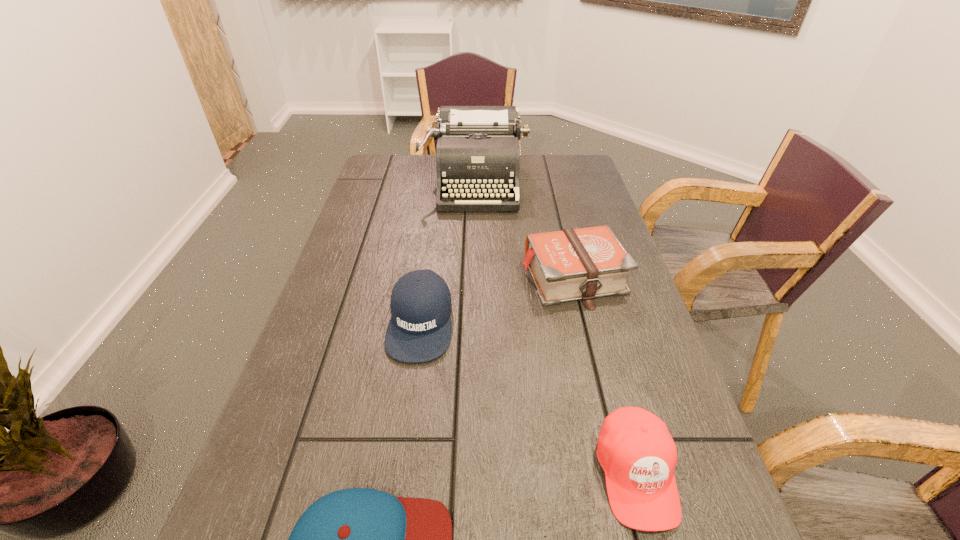
At what (x,y) coordinates should I click in order to perform the action: click on Bible at the right edge. Please return your answer as a coordinate pair (x, y). This screenshot has width=960, height=540. Looking at the image, I should click on (581, 264).

In the image, there is a desktop. In order to click on vacant space at the far edge in this screenshot , I will do `click(537, 159)`.

Identify the location of vacant space at the left edge. (342, 426).

Where is `free space at the right edge`? This screenshot has height=540, width=960. free space at the right edge is located at coordinates (615, 338).

Find the location of a particular element. This screenshot has height=540, width=960. empty space that is in between the tallest object and the farthest baseball cap is located at coordinates (447, 252).

The image size is (960, 540). What are the coordinates of `vacant area that lies between the Bible and the farthest baseball cap` in the screenshot? It's located at (496, 300).

Identify the location of empty location between the rightmost baseball cap and the Bible. The height and width of the screenshot is (540, 960). (605, 376).

Identify the location of free space between the typewriter and the Bible. (524, 230).

Find the location of `vacant space that's between the Bible and the rightmost baseball cap`. vacant space that's between the Bible and the rightmost baseball cap is located at coordinates (605, 376).

At what (x,y) coordinates should I click in order to perform the action: click on unoccupied area between the rightmost baseball cap and the Bible. Please return your answer as a coordinate pair (x, y). Looking at the image, I should click on (605, 376).